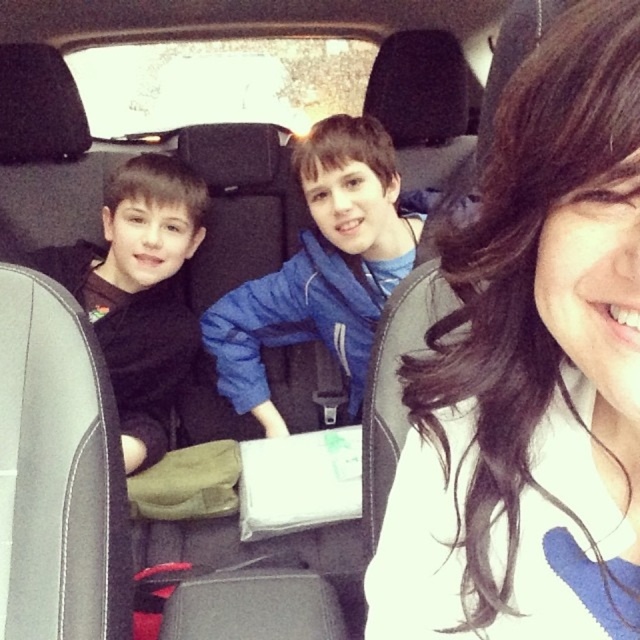
Question: Observing the image, what is the correct spatial positioning of smooth brown hair at center in reference to blue fleece jacket at center?

Choices:
 (A) left
 (B) right

Answer: (B)

Question: Which object is positioned farthest from the smooth brown hair at center?

Choices:
 (A) black matte jacket at left
 (B) blue fleece jacket at center

Answer: (A)

Question: Which point appears farthest from the camera in this image?

Choices:
 (A) (454, 605)
 (B) (134, 163)

Answer: (B)

Question: Does blue fleece jacket at center come behind black matte jacket at left?

Choices:
 (A) no
 (B) yes

Answer: (B)

Question: Does smooth brown hair at center appear on the right side of blue fleece jacket at center?

Choices:
 (A) no
 (B) yes

Answer: (B)

Question: Considering the real-world distances, which object is closest to the black matte jacket at left?

Choices:
 (A) smooth brown hair at center
 (B) blue fleece jacket at center

Answer: (B)